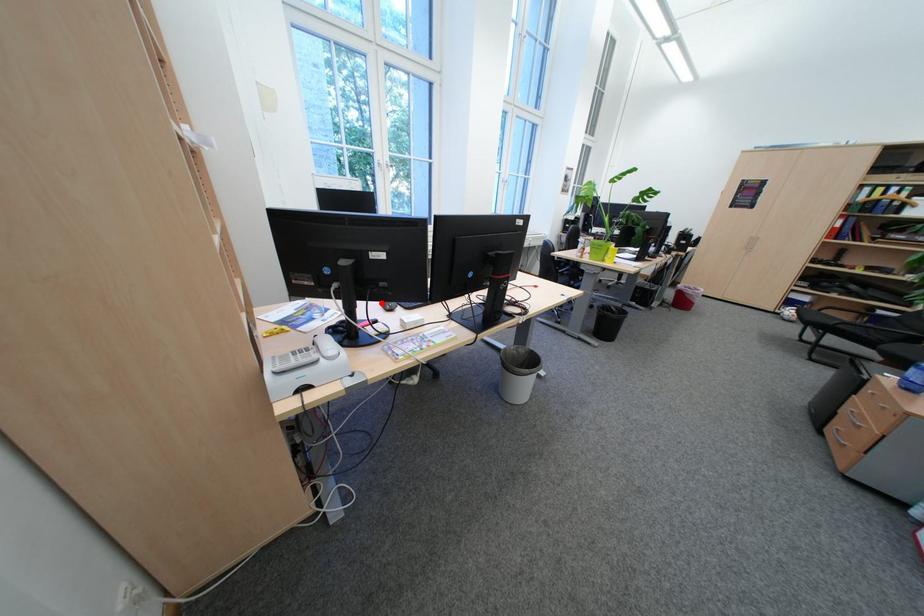
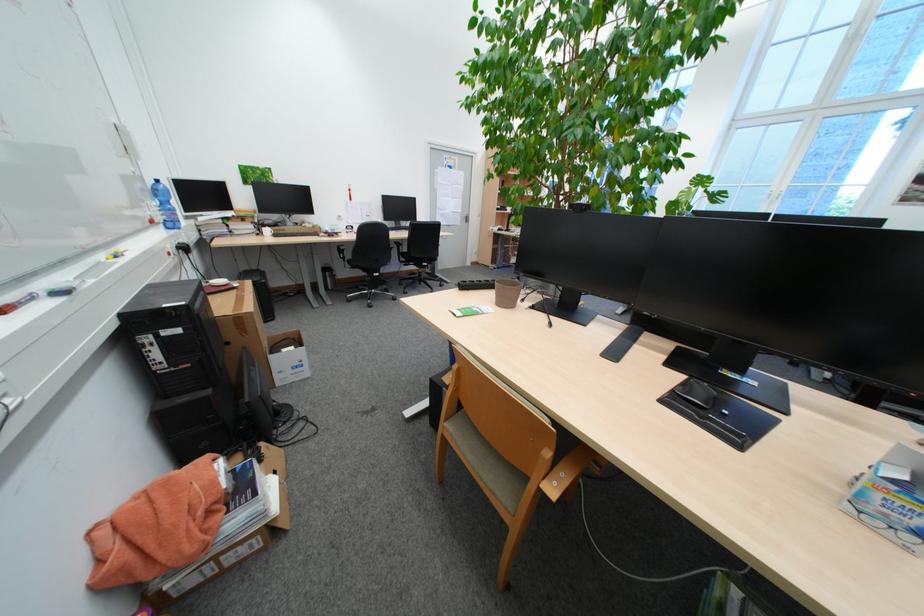
Question: I am providing you with two images of the same scene from different viewpoints. A red point is marked on the first image. Is the red point's position out of view in image 2?

Choices:
 (A) Yes
 (B) No

Answer: (A)